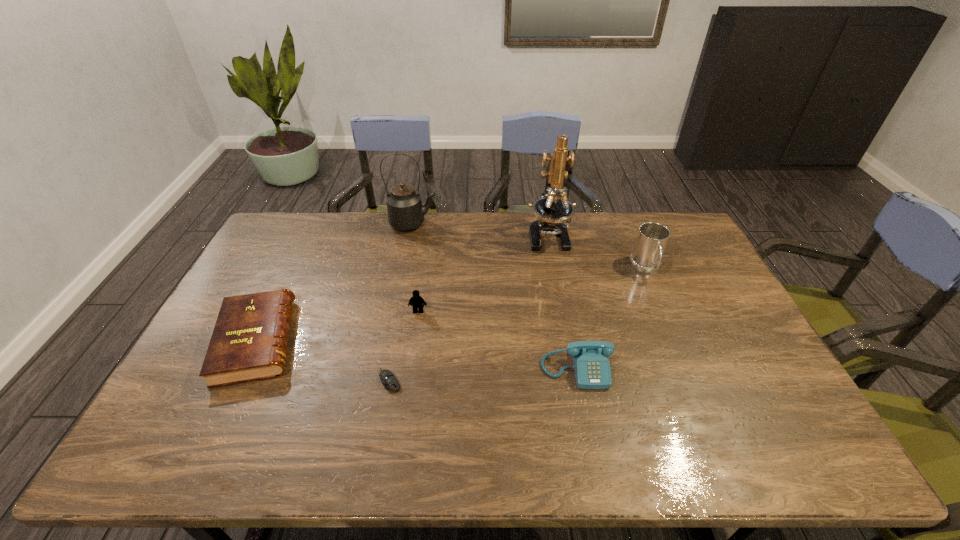
The image size is (960, 540). In the image, there is a desktop. In order to click on free space at the near edge in this screenshot , I will do `click(354, 436)`.

What are the coordinates of `vacant space at the left edge of the desktop` in the screenshot? It's located at (265, 275).

At what (x,y) coordinates should I click in order to perform the action: click on vacant space at the right edge of the desktop. Please return your answer as a coordinate pair (x, y). This screenshot has width=960, height=540. Looking at the image, I should click on (712, 320).

In the image, there is a desktop. Identify the location of vacant region at the far left corner. The width and height of the screenshot is (960, 540). (269, 246).

I want to click on vacant region between the rightmost object and the kettle, so click(x=530, y=246).

Identify the location of vacant area that lies between the third tallest object and the microscope. The height and width of the screenshot is (540, 960). (597, 252).

Locate an element on the screen. The width and height of the screenshot is (960, 540). free space between the computer mouse and the hardback book is located at coordinates (324, 361).

Find the location of `vacant region between the Lego and the rightmost object`. vacant region between the Lego and the rightmost object is located at coordinates (532, 290).

In order to click on vacant area between the Lego and the sixth tallest object in this screenshot , I will do [338, 326].

Identify the location of vacant space in between the microscope and the Lego. The image size is (960, 540). (483, 273).